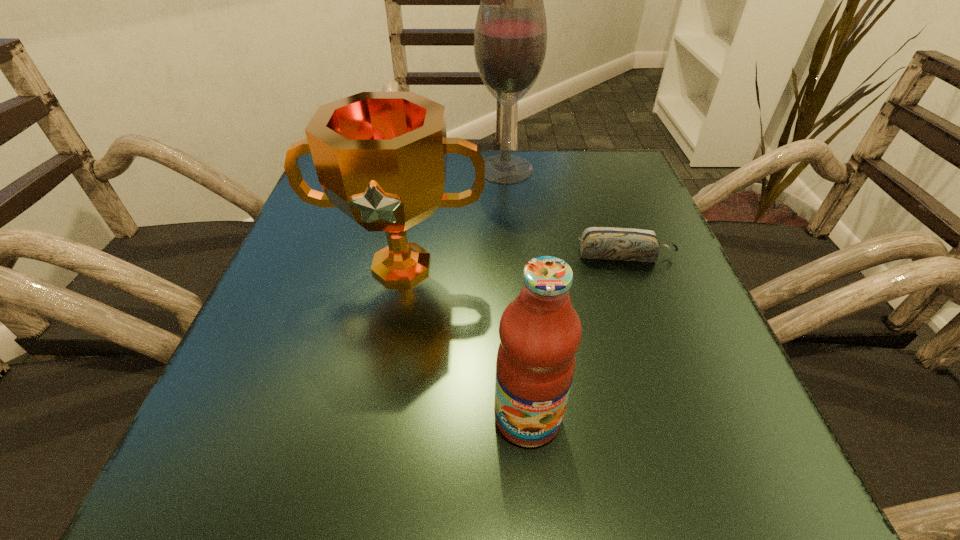
Locate an element on the screen. The width and height of the screenshot is (960, 540). free point between the farthest object and the pencil box is located at coordinates (564, 212).

The height and width of the screenshot is (540, 960). In order to click on empty location between the award and the rightmost object in this screenshot , I will do `click(514, 261)`.

This screenshot has width=960, height=540. I want to click on vacant area that lies between the award and the nearest object, so click(465, 342).

Where is `unoccupied area between the award and the fruit juice`? This screenshot has width=960, height=540. unoccupied area between the award and the fruit juice is located at coordinates (465, 342).

Where is `free space between the pencil box and the award`? The width and height of the screenshot is (960, 540). free space between the pencil box and the award is located at coordinates (514, 261).

At what (x,y) coordinates should I click in order to perform the action: click on vacant area that lies between the award and the pencil box. Please return your answer as a coordinate pair (x, y). Looking at the image, I should click on (514, 261).

At what (x,y) coordinates should I click in order to perform the action: click on free space between the rightmost object and the award. Please return your answer as a coordinate pair (x, y). Looking at the image, I should click on (514, 261).

The width and height of the screenshot is (960, 540). What are the coordinates of `empty space that is in between the pencil box and the award` in the screenshot? It's located at pos(514,261).

Identify the location of vacant space that's between the nearest object and the award. This screenshot has height=540, width=960. (465, 342).

The height and width of the screenshot is (540, 960). What are the coordinates of `the second closest object to the farthest object` in the screenshot? It's located at (626, 244).